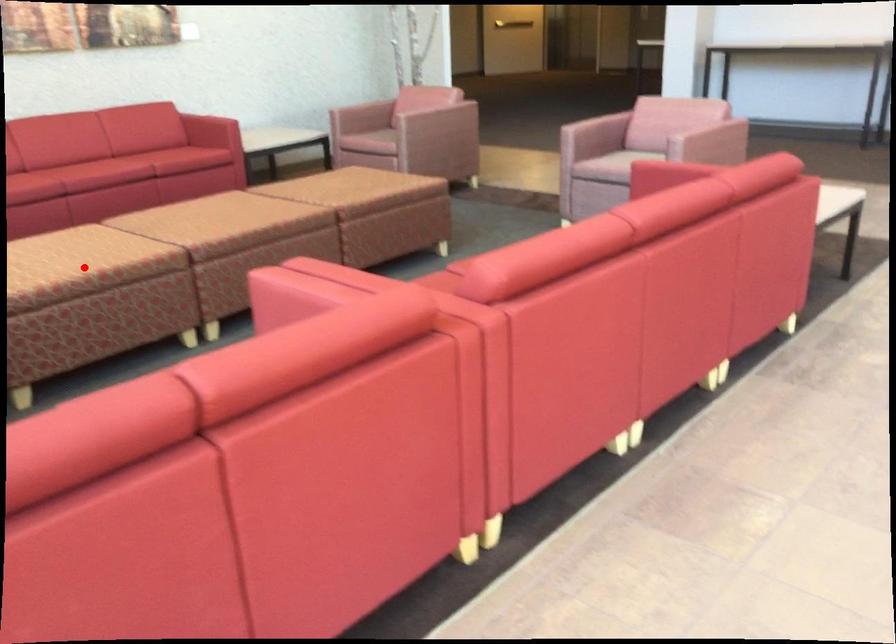
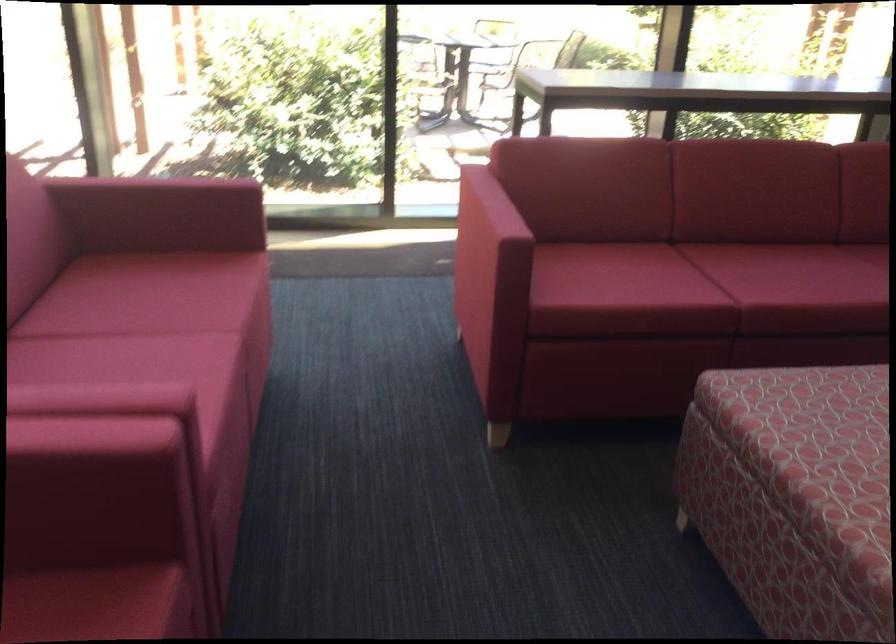
Find the pixel in the second image that matches the highlighted location in the first image.

(815, 460)